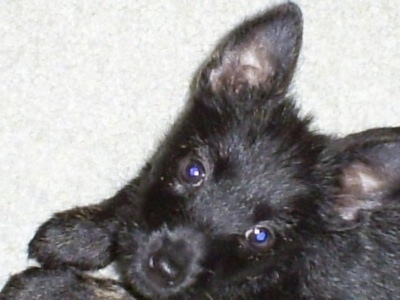
Identify the location of canvas. (349, 80).